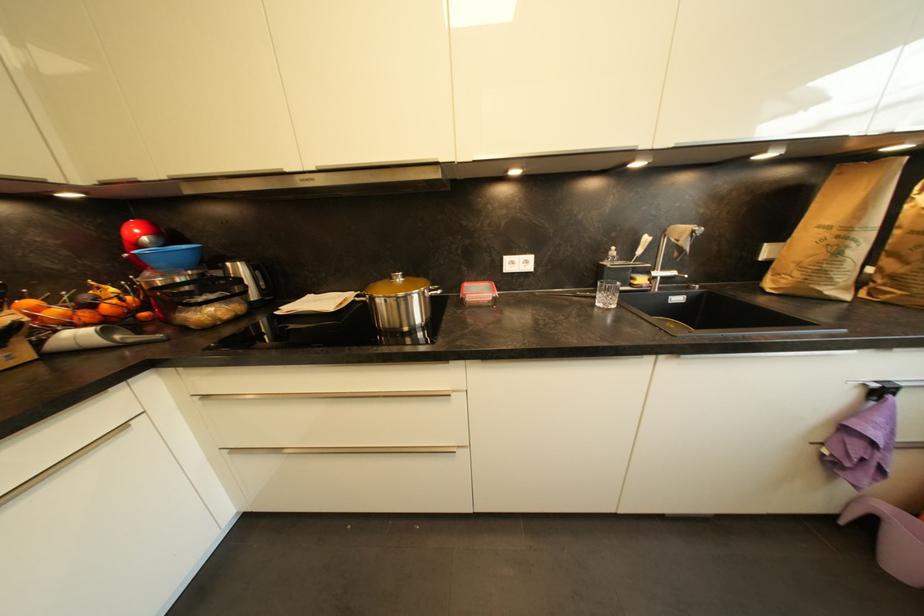
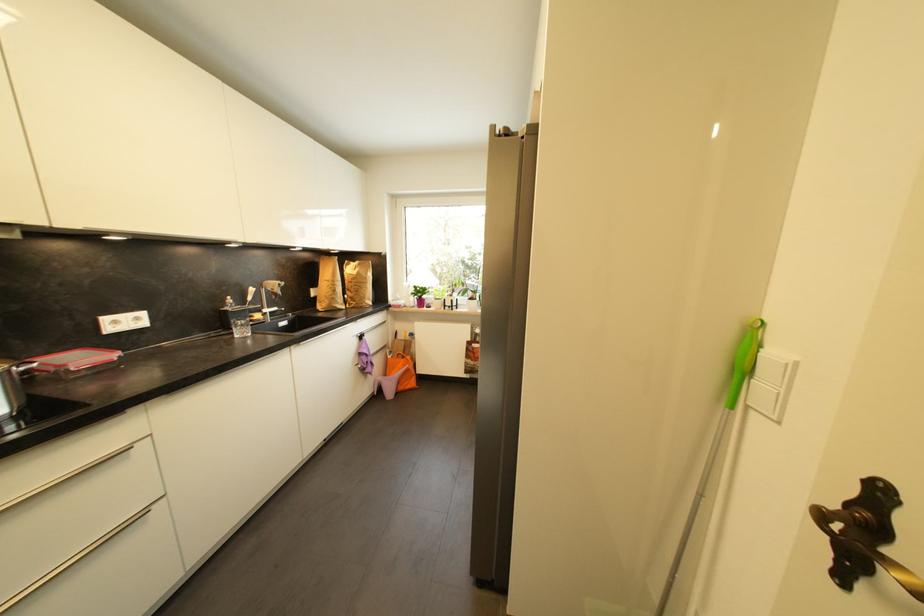
The point at (480, 283) is marked in the first image. Where is the corresponding point in the second image?

(54, 355)